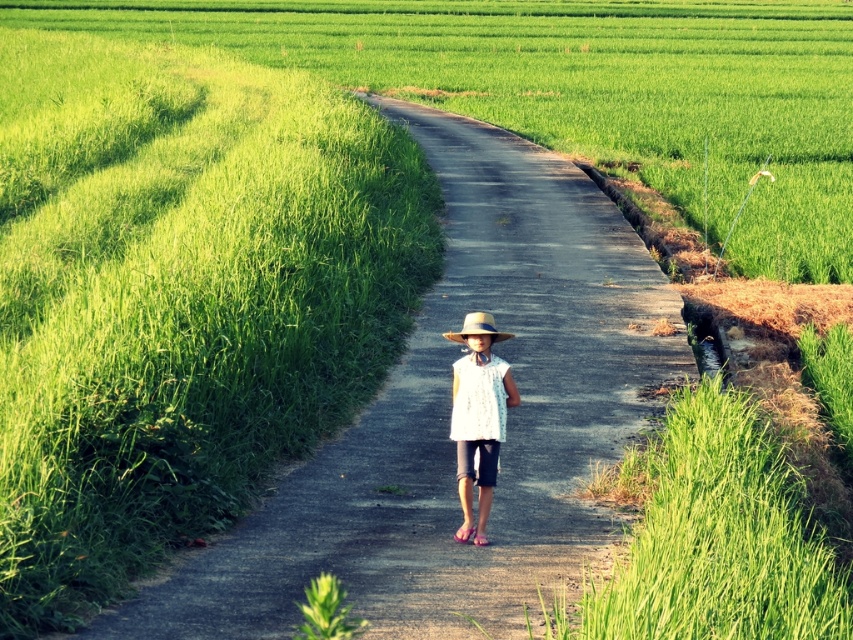
You are standing at the point marked as point (448, 419) in the image. What is directly beneath your feet?

The dirt road at center is located at point (448, 419), so the dirt road at center is directly beneath your feet.

You are a photographer trying to capture the child in the scene. If you want to focus on the white lace dress at center without the natural straw hat at center blocking it, where should you position yourself relative to the child?

You should position yourself behind the child so that the natural straw hat at center, which is behind the white lace dress at center, will be out of frame or less obstructive, allowing the white lace dress at center to be the main focus.

You are a drone operator trying to capture a photo of the child in the rice fields. You have two points marked on your screen, point (386, 108) and point (468, 324). Which point is closer to the child?

Point (386, 108) is further to the viewer than point (468, 324), so the closer point to the child would be point (468, 324).